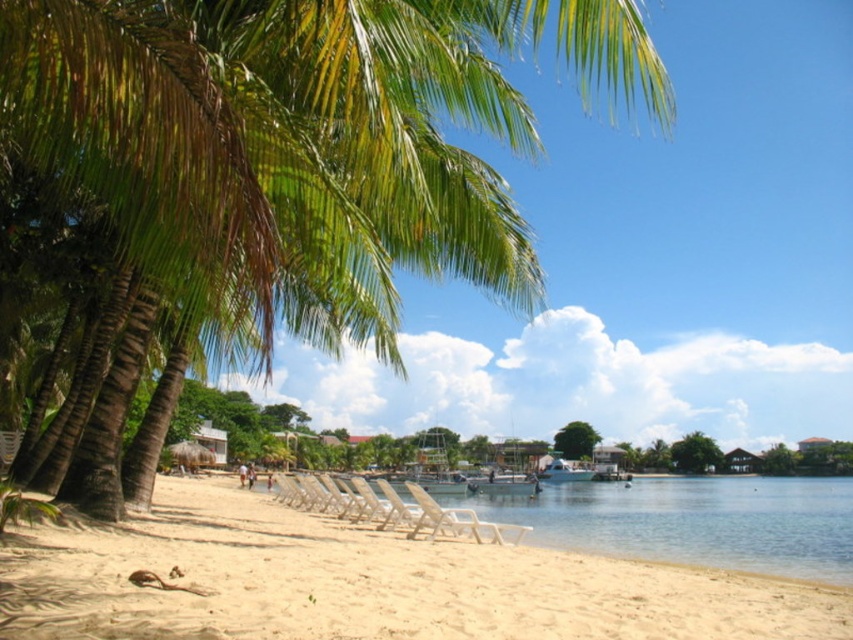
Between beige sand at lower left and clear water at lower center, which one has less height?

beige sand at lower left

Who is more distant from viewer, (550,584) or (798,513)?

The point (798,513) is more distant.

Identify the location of beige sand at lower left. (369, 582).

Is beige sand at lower left bigger than white plastic beach chair at lower center?

Yes, beige sand at lower left is bigger than white plastic beach chair at lower center.

At what (x,y) coordinates should I click in order to perform the action: click on beige sand at lower left. Please return your answer as a coordinate pair (x, y). Image resolution: width=853 pixels, height=640 pixels. Looking at the image, I should click on (369, 582).

Who is more distant from viewer, (737, 609) or (485, 538)?

Point (485, 538)

Identify the location of beige sand at lower left. The height and width of the screenshot is (640, 853). (369, 582).

How distant is green leafy palm tree at upper left from beige sand at lower left?

green leafy palm tree at upper left is 4.28 meters from beige sand at lower left.

Who is more distant from viewer, (x=361, y=12) or (x=277, y=595)?

The point (x=277, y=595) is more distant.

Is point (413, 131) in front of point (303, 630)?

No, it is not.

This screenshot has height=640, width=853. I want to click on green leafy palm tree at upper left, so [302, 144].